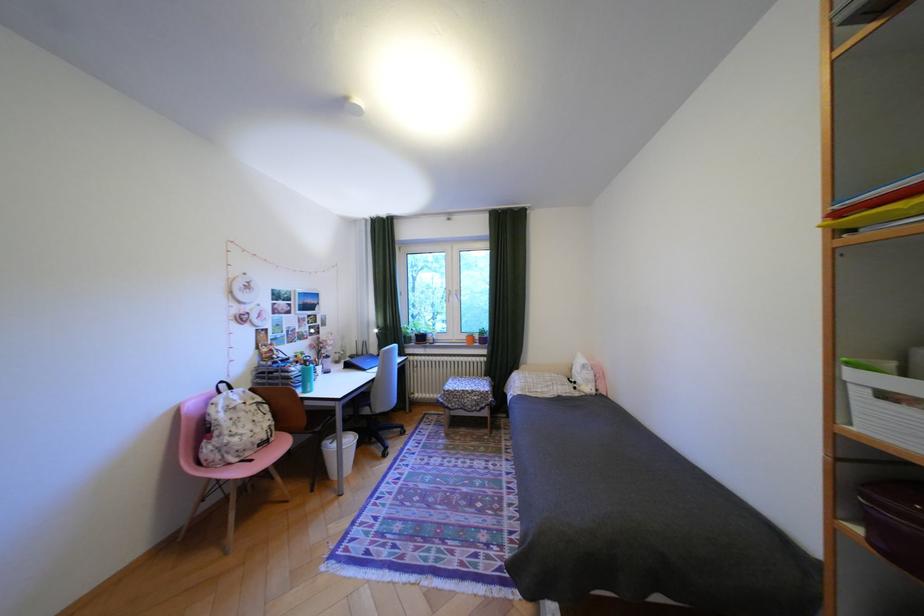
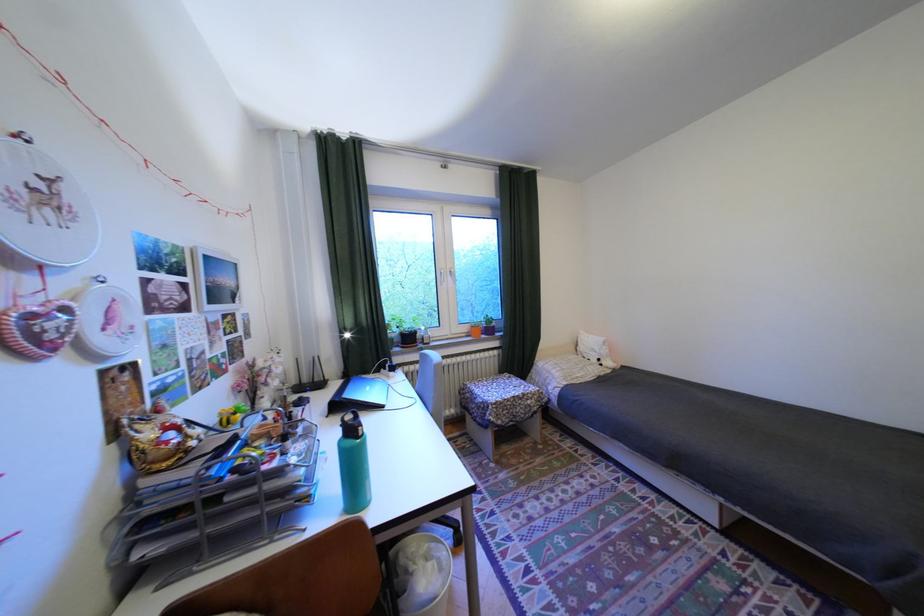
Where in the second image is the point corresponding to [390,328] from the first image?

(354, 330)